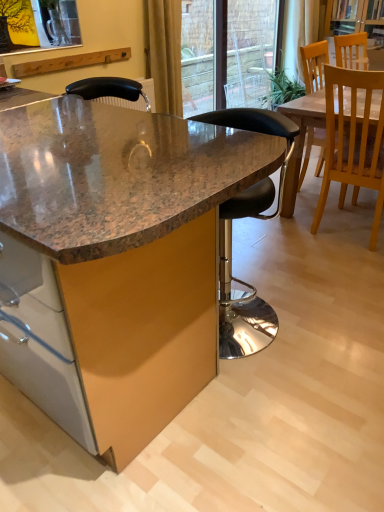
Question: Is black leather stool at center, the 1th chair viewed from the left, beside yellow fabric curtain at upper center, marked as the 2th curtain in a right-to-left arrangement?

Choices:
 (A) yes
 (B) no

Answer: (B)

Question: From the image's perspective, is black leather stool at center, positioned as the 3th chair in right-to-left order, on yellow fabric curtain at upper center, which is the 1th curtain in front-to-back order?

Choices:
 (A) no
 (B) yes

Answer: (A)

Question: Can you confirm if black leather stool at center, positioned as the 3th chair in right-to-left order, is wider than yellow fabric curtain at upper center, which is the second curtain in top-to-bottom order?

Choices:
 (A) yes
 (B) no

Answer: (A)

Question: Considering the relative sizes of black leather stool at center, positioned as the 3th chair in right-to-left order, and yellow fabric curtain at upper center, positioned as the first curtain in bottom-to-top order, in the image provided, is black leather stool at center, positioned as the 3th chair in right-to-left order, smaller than yellow fabric curtain at upper center, positioned as the first curtain in bottom-to-top order,?

Choices:
 (A) yes
 (B) no

Answer: (B)

Question: Can you confirm if black leather stool at center, positioned as the 3th chair in right-to-left order, is shorter than yellow fabric curtain at upper center, which is the 1th curtain in front-to-back order?

Choices:
 (A) yes
 (B) no

Answer: (B)

Question: Considering the positions of wooden chair at upper right, which is the 1th chair from right to left, and white sheer curtain at upper center, placed as the 1th curtain when sorted from right to left, in the image, is wooden chair at upper right, which is the 1th chair from right to left, wider or thinner than white sheer curtain at upper center, placed as the 1th curtain when sorted from right to left,?

Choices:
 (A) wide
 (B) thin

Answer: (A)

Question: In terms of size, does wooden chair at upper right, positioned as the 3th chair in left-to-right order, appear bigger or smaller than white sheer curtain at upper center, the first curtain when ordered from top to bottom?

Choices:
 (A) small
 (B) big

Answer: (A)

Question: Is point (344, 34) positioned closer to the camera than point (299, 33)?

Choices:
 (A) closer
 (B) farther

Answer: (A)

Question: Considering the relative positions of wooden chair at upper right, which is the 1th chair from right to left, and white sheer curtain at upper center, the second curtain when ordered from bottom to top, in the image provided, is wooden chair at upper right, which is the 1th chair from right to left, to the left or to the right of white sheer curtain at upper center, the second curtain when ordered from bottom to top,?

Choices:
 (A) right
 (B) left

Answer: (A)

Question: From the image's perspective, is granite table at center above or below black leather stool at center, the 1th chair viewed from the left?

Choices:
 (A) below
 (B) above

Answer: (A)

Question: Considering the relative positions of granite table at center and black leather stool at center, the 1th chair viewed from the left, in the image provided, is granite table at center to the left or to the right of black leather stool at center, the 1th chair viewed from the left,?

Choices:
 (A) left
 (B) right

Answer: (A)

Question: Considering their positions, is granite table at center located in front of or behind black leather stool at center, positioned as the 3th chair in right-to-left order?

Choices:
 (A) behind
 (B) front

Answer: (B)

Question: Considering the positions of granite table at center and black leather stool at center, the 1th chair viewed from the left, in the image, is granite table at center bigger or smaller than black leather stool at center, the 1th chair viewed from the left,?

Choices:
 (A) big
 (B) small

Answer: (A)

Question: Which is correct: light wood chair at right, the second chair in the right-to-left sequence, is inside white sheer curtain at upper center, the second curtain when ordered from bottom to top, or outside of it?

Choices:
 (A) outside
 (B) inside

Answer: (A)

Question: From the image's perspective, relative to white sheer curtain at upper center, the second curtain when ordered from bottom to top, is light wood chair at right, which appears as the second chair when viewed from the left, above or below?

Choices:
 (A) below
 (B) above

Answer: (A)